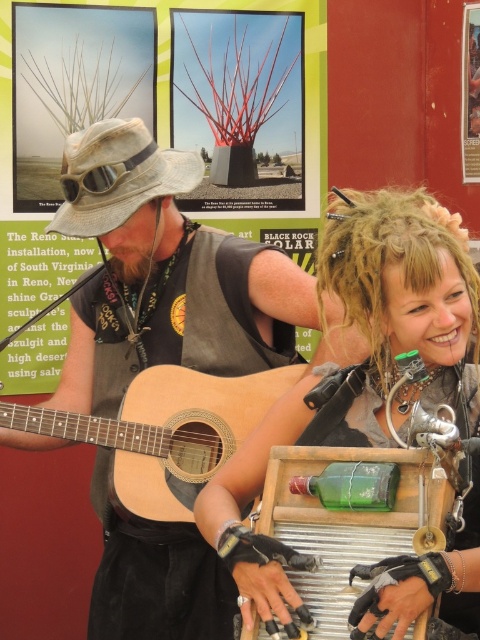
Question: Is metallic sculpture at upper center below green glass bottle at center?

Choices:
 (A) no
 (B) yes

Answer: (A)

Question: Estimate the real-world distances between objects in this image. Which object is farther from the brushed metal poster at upper center?

Choices:
 (A) natural wood acoustic guitar at center
 (B) green glass bottle at center

Answer: (A)

Question: Is natural wood acoustic guitar at center above light brown straw hat at center?

Choices:
 (A) yes
 (B) no

Answer: (B)

Question: Among these points, which one is farthest from the camera?

Choices:
 (A) (2, 426)
 (B) (381, 193)

Answer: (A)

Question: Considering the real-world distances, which object is farthest from the metallic sculpture at upper center?

Choices:
 (A) natural wood acoustic guitar at center
 (B) curly blonde hair at upper right
 (C) light brown straw hat at center

Answer: (B)

Question: Can you confirm if curly blonde hair at upper right is smaller than matte black goggles at center?

Choices:
 (A) yes
 (B) no

Answer: (B)